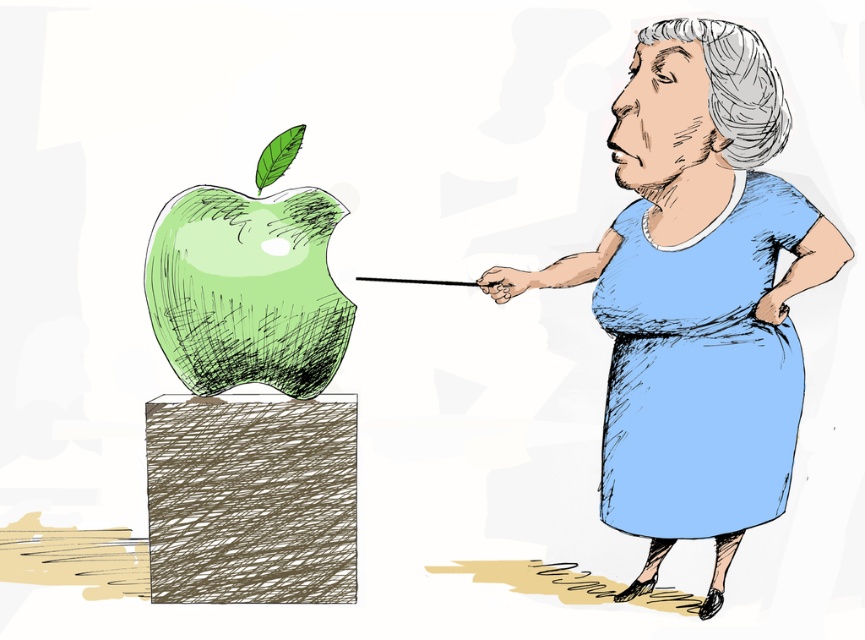
Does blue fabric dress at right appear on the left side of green sketched apple at center?

Incorrect, blue fabric dress at right is not on the left side of green sketched apple at center.

How distant is blue fabric dress at right from green sketched apple at center?

The distance of blue fabric dress at right from green sketched apple at center is 17.82 inches.

This screenshot has height=640, width=865. Find the location of `blue fabric dress at right`. blue fabric dress at right is located at coordinates 697,296.

Identify the location of blue fabric dress at right. Image resolution: width=865 pixels, height=640 pixels. (697, 296).